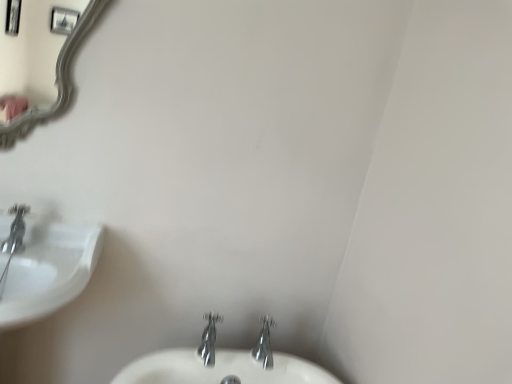
Question: Would you say chrome metallic faucet at lower center, arranged as the 2th tap when viewed from the left, is inside or outside white glossy sink at left?

Choices:
 (A) outside
 (B) inside

Answer: (A)

Question: From the image's perspective, relative to white glossy sink at left, is chrome metallic faucet at lower center, placed as the 1th tap when sorted from right to left, above or below?

Choices:
 (A) below
 (B) above

Answer: (A)

Question: Which object is the closest to the polished chrome faucet at center, the second tap when ordered from right to left?

Choices:
 (A) white glossy sink at left
 (B) chrome metallic faucet at lower center, placed as the 1th tap when sorted from right to left

Answer: (B)

Question: Based on their relative distances, which object is nearer to the polished chrome faucet at center, the second tap when ordered from right to left?

Choices:
 (A) white glossy sink at left
 (B) chrome metallic faucet at lower center, placed as the 1th tap when sorted from right to left

Answer: (B)